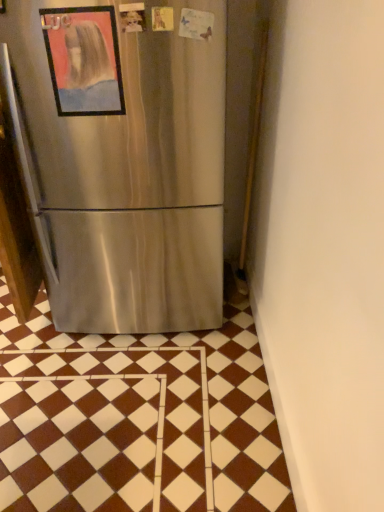
Identify the location of metallic framed painting at upper left. This screenshot has height=512, width=384. (84, 60).

Image resolution: width=384 pixels, height=512 pixels. What do you see at coordinates (84, 60) in the screenshot? I see `metallic framed painting at upper left` at bounding box center [84, 60].

What is the approximate height of brown glossy tile at center?

2.89 inches.

This screenshot has width=384, height=512. What do you see at coordinates (136, 421) in the screenshot?
I see `brown glossy tile at center` at bounding box center [136, 421].

Measure the distance between point (68, 368) and camera.

Point (68, 368) is 5.81 feet away from camera.

Find the location of a particular element. This screenshot has height=512, width=384. brown glossy tile at center is located at coordinates (136, 421).

Locate an element on the screen. metallic framed painting at upper left is located at coordinates [84, 60].

Which object is positioned more to the left, brown glossy tile at center or metallic framed painting at upper left?

Positioned to the left is brown glossy tile at center.

Which object is further away from the camera, brown glossy tile at center or metallic framed painting at upper left?

metallic framed painting at upper left is behind.

Is point (249, 377) closer to viewer compared to point (87, 83)?

No, it is behind (87, 83).

From the image's perspective, is brown glossy tile at center on top of metallic framed painting at upper left?

No, from the image's perspective, brown glossy tile at center is not on top of metallic framed painting at upper left.

From a real-world perspective, is brown glossy tile at center on top of metallic framed painting at upper left?

No, from a real-world perspective, brown glossy tile at center is not over metallic framed painting at upper left

Is brown glossy tile at center wider than metallic framed painting at upper left?

Indeed, brown glossy tile at center has a greater width compared to metallic framed painting at upper left.

Is brown glossy tile at center taller or shorter than metallic framed painting at upper left?

Considering their sizes, brown glossy tile at center has less height than metallic framed painting at upper left.

Is brown glossy tile at center smaller than metallic framed painting at upper left?

No, brown glossy tile at center is not smaller than metallic framed painting at upper left.

Would you say brown glossy tile at center is outside metallic framed painting at upper left?

Yes, brown glossy tile at center is located beyond the bounds of metallic framed painting at upper left.

Is the surface of brown glossy tile at center in direct contact with metallic framed painting at upper left?

They are not placed beside each other.

Is metallic framed painting at upper left at the back of brown glossy tile at center?

No, brown glossy tile at center's orientation is not away from metallic framed painting at upper left.

Measure the distance from brown glossy tile at center to metallic framed painting at upper left.

They are 3.71 feet apart.

The image size is (384, 512). In order to click on picture frame lying behind the brown glossy tile at center in this screenshot , I will do `click(84, 60)`.

Considering the relative positions of metallic framed painting at upper left and brown glossy tile at center in the image provided, is metallic framed painting at upper left to the right of brown glossy tile at center from the viewer's perspective?

Indeed, metallic framed painting at upper left is positioned on the right side of brown glossy tile at center.

Between metallic framed painting at upper left and brown glossy tile at center, which one is positioned behind?

metallic framed painting at upper left is more distant.

Considering the positions of point (93, 98) and point (154, 365), is point (93, 98) closer or farther from the camera than point (154, 365)?

Point (93, 98) is positioned closer to the camera compared to point (154, 365).

From the image's perspective, who appears lower, metallic framed painting at upper left or brown glossy tile at center?

From the image's view, brown glossy tile at center is below.

From a real-world perspective, is metallic framed painting at upper left positioned over brown glossy tile at center based on gravity?

Yes, from a real-world perspective, metallic framed painting at upper left is above brown glossy tile at center.

Which object is thinner, metallic framed painting at upper left or brown glossy tile at center?

metallic framed painting at upper left.

Who is taller, metallic framed painting at upper left or brown glossy tile at center?

Standing taller between the two is metallic framed painting at upper left.

Considering the sizes of metallic framed painting at upper left and brown glossy tile at center in the image, is metallic framed painting at upper left bigger or smaller than brown glossy tile at center?

In the image, metallic framed painting at upper left appears to be smaller than brown glossy tile at center.

Could brown glossy tile at center be considered to be inside metallic framed painting at upper left?

No, brown glossy tile at center is not inside metallic framed painting at upper left.

Is metallic framed painting at upper left touching brown glossy tile at center?

No, metallic framed painting at upper left is not touching brown glossy tile at center.

Is metallic framed painting at upper left turned away from brown glossy tile at center?

metallic framed painting at upper left does not have its back to brown glossy tile at center.

Locate an element on the screen. tile in front of the metallic framed painting at upper left is located at coordinates 136,421.

Locate an element on the screen. Image resolution: width=384 pixels, height=512 pixels. tile lying in front of the metallic framed painting at upper left is located at coordinates (136, 421).

This screenshot has width=384, height=512. In order to click on picture frame that is on the right side of brown glossy tile at center in this screenshot , I will do `click(84, 60)`.